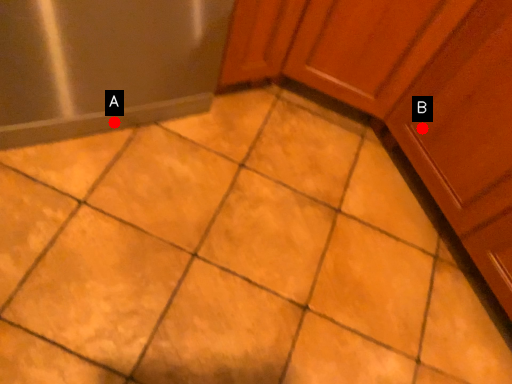
Question: Two points are circled on the image, labeled by A and B beside each circle. Which point is farther to the camera?

Choices:
 (A) A is further
 (B) B is further

Answer: (B)